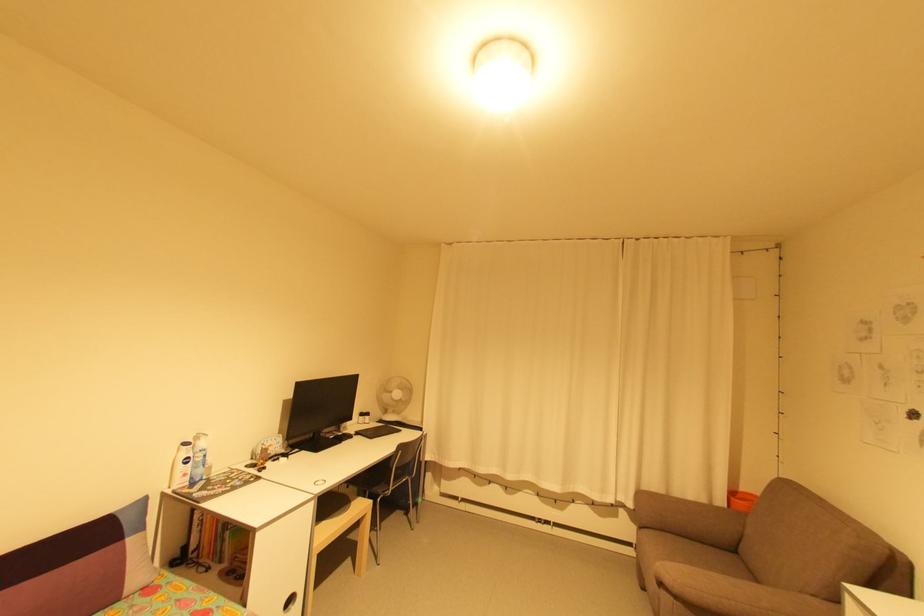
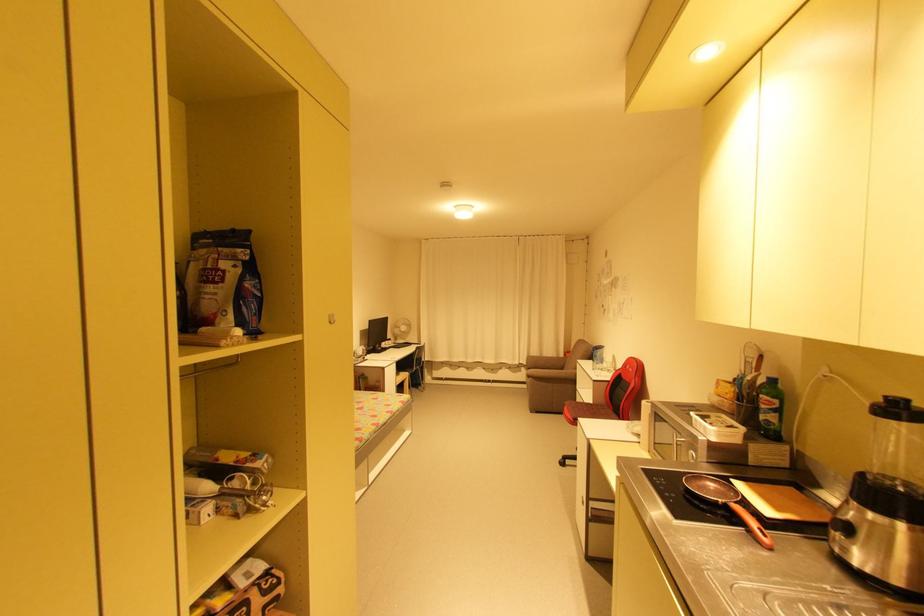
Question: Which direction would the cameraman need to move to produce the second image? Reply with the corresponding letter.

Choices:
 (A) Left
 (B) Right
 (C) Forward
 (D) Backward

Answer: (D)